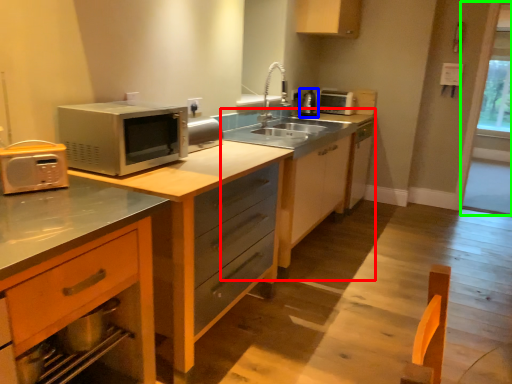
Question: Estimate the real-world distances between objects in this image. Which object is farther from dresser (highlighted by a red box), appliance (highlighted by a blue box) or window screen (highlighted by a green box)?

Choices:
 (A) appliance
 (B) window screen

Answer: (B)